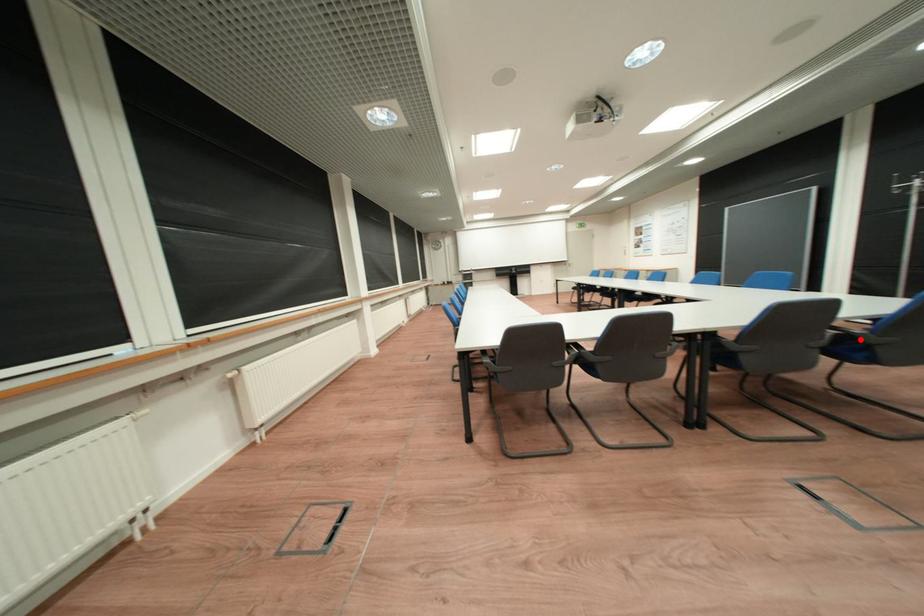
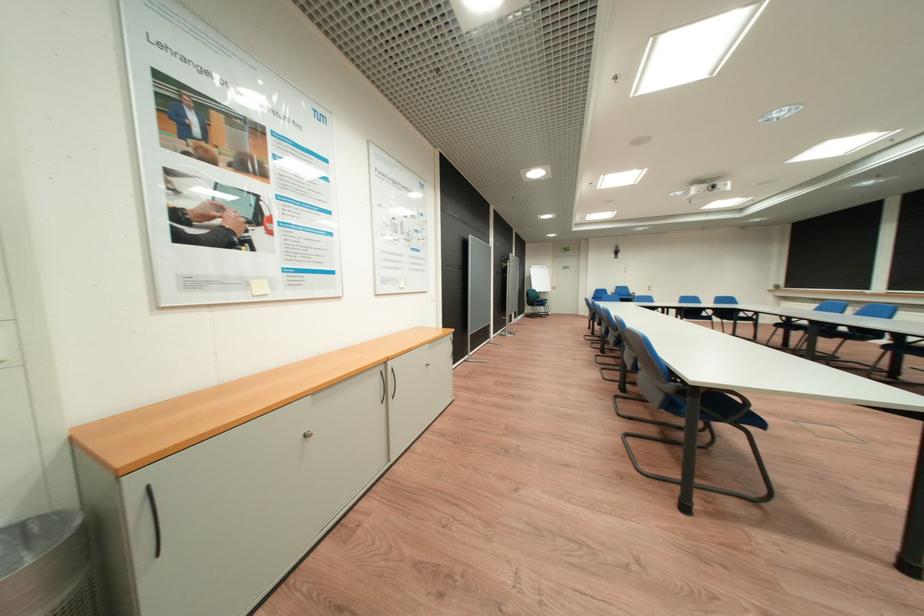
Question: I am providing you with two images of the same scene from different viewpoints. A red point is marked on the first image. Can you still see the location of the red point in image 2?

Choices:
 (A) Yes
 (B) No

Answer: (B)